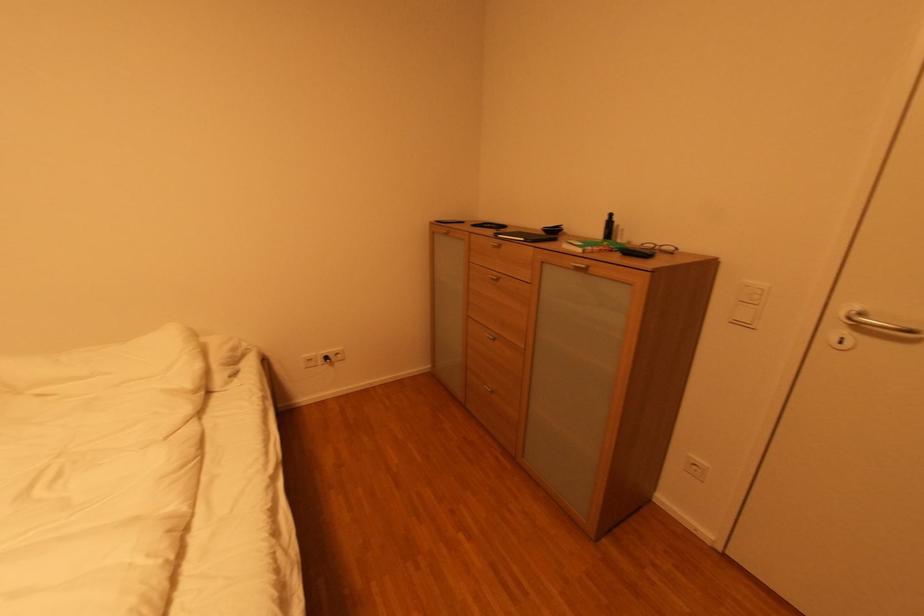
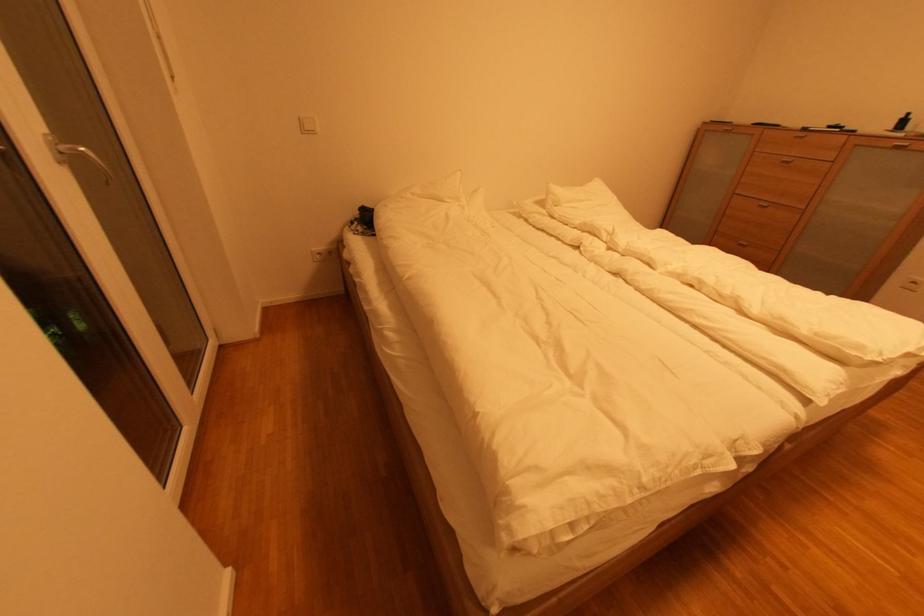
The images are taken continuously from a first-person perspective. In which direction are you moving?

The cameraman walked toward left, backward.